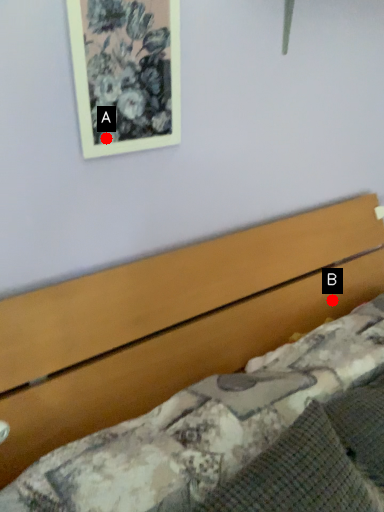
Question: Two points are circled on the image, labeled by A and B beside each circle. Which of the following is the farthest from the observer?

Choices:
 (A) A is further
 (B) B is further

Answer: (B)